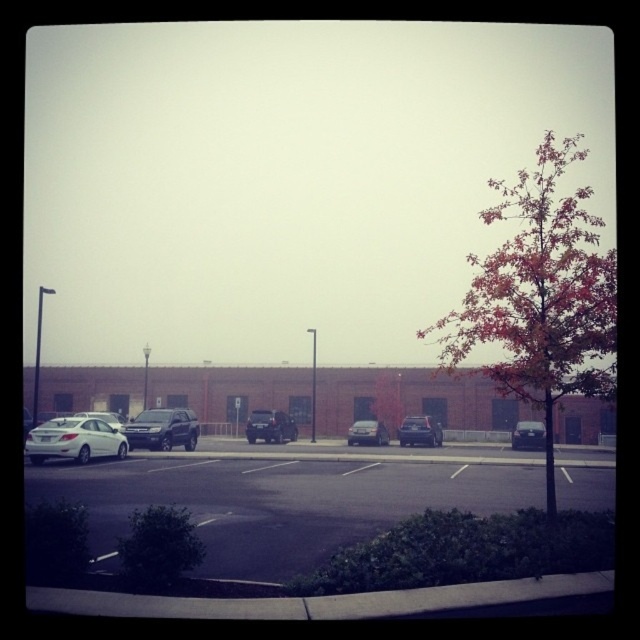
Question: Which point is farther to the camera?

Choices:
 (A) silver metallic sedan at left
 (B) orange leafy tree at right
 (C) white matte sedan at left

Answer: (A)

Question: Which object is the farthest from the shiny black suv at center?

Choices:
 (A) matte black suv at center
 (B) white matte sedan at left
 (C) matte black sedan at center
 (D) satin black sedan at center

Answer: (D)

Question: Does orange leafy tree at right have a lesser width compared to shiny black suv at center?

Choices:
 (A) no
 (B) yes

Answer: (A)

Question: From the image, what is the correct spatial relationship of white matte sedan at left in relation to shiny black suv at center?

Choices:
 (A) above
 (B) below

Answer: (A)

Question: Can you confirm if orange leafy tree at right is wider than matte black suv at center?

Choices:
 (A) no
 (B) yes

Answer: (B)

Question: Which point is closer to the camera?

Choices:
 (A) satin black sedan at center
 (B) matte black sedan at center
 (C) white matte sedan at left
 (D) orange leafy tree at center

Answer: (C)